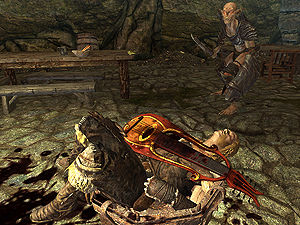
Find the location of `table`. table is located at coordinates (115, 58).